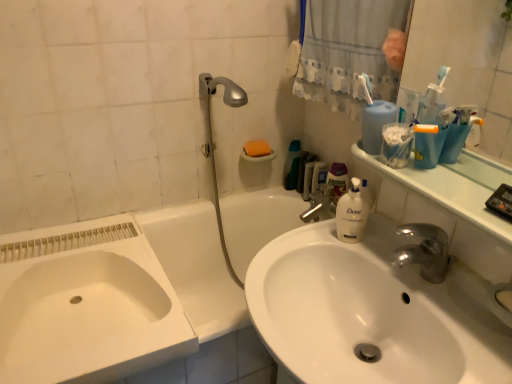
Question: Can you confirm if white ceramic bathtub at lower left is positioned to the left of orange sponge at upper center?

Choices:
 (A) no
 (B) yes

Answer: (B)

Question: From the image's perspective, is white ceramic bathtub at lower left located beneath orange sponge at upper center?

Choices:
 (A) no
 (B) yes

Answer: (B)

Question: Does white ceramic bathtub at lower left come behind orange sponge at upper center?

Choices:
 (A) yes
 (B) no

Answer: (B)

Question: Does white ceramic bathtub at lower left have a greater width compared to orange sponge at upper center?

Choices:
 (A) no
 (B) yes

Answer: (B)

Question: Can we say white ceramic bathtub at lower left lies outside orange sponge at upper center?

Choices:
 (A) yes
 (B) no

Answer: (A)

Question: Considering the positions of white fabric shower curtain at upper center and clear plastic mouthwash at center in the image, is white fabric shower curtain at upper center taller or shorter than clear plastic mouthwash at center?

Choices:
 (A) short
 (B) tall

Answer: (B)

Question: Considering the positions of white fabric shower curtain at upper center and clear plastic mouthwash at center in the image, is white fabric shower curtain at upper center bigger or smaller than clear plastic mouthwash at center?

Choices:
 (A) big
 (B) small

Answer: (A)

Question: Which is correct: white fabric shower curtain at upper center is inside clear plastic mouthwash at center, or outside of it?

Choices:
 (A) inside
 (B) outside

Answer: (B)

Question: Is white fabric shower curtain at upper center in front of or behind clear plastic mouthwash at center in the image?

Choices:
 (A) behind
 (B) front

Answer: (B)

Question: In terms of width, does white ceramic bathtub at lower left look wider or thinner when compared to white glossy sink at lower left, acting as the 2th sink starting from the right?

Choices:
 (A) wide
 (B) thin

Answer: (B)

Question: Based on their sizes in the image, would you say white ceramic bathtub at lower left is bigger or smaller than white glossy sink at lower left, which is the first sink in left-to-right order?

Choices:
 (A) small
 (B) big

Answer: (B)

Question: From the image's perspective, relative to white glossy sink at lower left, which is the first sink in left-to-right order, is white ceramic bathtub at lower left above or below?

Choices:
 (A) below
 (B) above

Answer: (A)

Question: Is white ceramic bathtub at lower left in front of or behind white glossy sink at lower left, which is the first sink in left-to-right order, in the image?

Choices:
 (A) behind
 (B) front

Answer: (B)

Question: Is translucent plastic bottle at center, marked as the 1th cleaning product in a right-to-left arrangement, inside or outside of white glossy sink at center, which appears as the first sink when viewed from the right?

Choices:
 (A) inside
 (B) outside

Answer: (B)

Question: Considering their positions, is translucent plastic bottle at center, the 2th cleaning product positioned from the left, located in front of or behind white glossy sink at center, which appears as the first sink when viewed from the right?

Choices:
 (A) front
 (B) behind

Answer: (B)